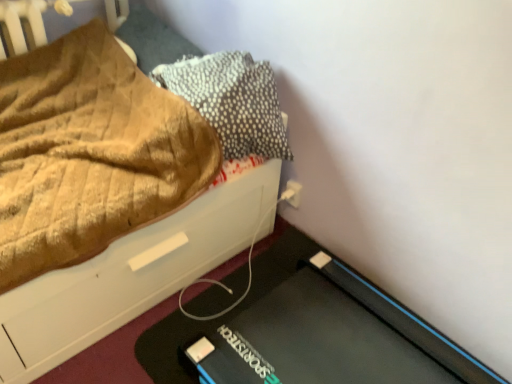
Question: Is brown textured pillow at upper left, placed as the 2th pillow when sorted from right to left, beside brown textured fabric at upper left?

Choices:
 (A) no
 (B) yes

Answer: (A)

Question: Is brown textured pillow at upper left, placed as the 2th pillow when sorted from right to left, shorter than brown textured fabric at upper left?

Choices:
 (A) yes
 (B) no

Answer: (A)

Question: Is brown textured pillow at upper left, positioned as the 1th pillow in left-to-right order, facing towards brown textured fabric at upper left?

Choices:
 (A) no
 (B) yes

Answer: (B)

Question: Is brown textured fabric at upper left located within brown textured pillow at upper left, placed as the 2th pillow when sorted from right to left?

Choices:
 (A) no
 (B) yes

Answer: (A)

Question: Is brown textured pillow at upper left, positioned as the 1th pillow in left-to-right order, not close to brown textured fabric at upper left?

Choices:
 (A) no
 (B) yes

Answer: (A)

Question: Does brown textured pillow at upper left, positioned as the 1th pillow in left-to-right order, lie behind brown textured fabric at upper left?

Choices:
 (A) yes
 (B) no

Answer: (A)

Question: Can you confirm if white plastic electric outlet at lower right is bigger than brown textured pillow at upper left, placed as the 2th pillow when sorted from right to left?

Choices:
 (A) no
 (B) yes

Answer: (A)

Question: Can we say white plastic electric outlet at lower right lies outside brown textured pillow at upper left, placed as the 2th pillow when sorted from right to left?

Choices:
 (A) no
 (B) yes

Answer: (B)

Question: Is white plastic electric outlet at lower right at the right side of brown textured pillow at upper left, positioned as the 1th pillow in left-to-right order?

Choices:
 (A) yes
 (B) no

Answer: (A)

Question: Is white plastic electric outlet at lower right taller than brown textured pillow at upper left, placed as the 2th pillow when sorted from right to left?

Choices:
 (A) no
 (B) yes

Answer: (A)

Question: Is white plastic electric outlet at lower right thinner than brown textured pillow at upper left, placed as the 2th pillow when sorted from right to left?

Choices:
 (A) yes
 (B) no

Answer: (A)

Question: Is white plastic electric outlet at lower right oriented away from brown textured pillow at upper left, placed as the 2th pillow when sorted from right to left?

Choices:
 (A) no
 (B) yes

Answer: (A)

Question: Is there a large distance between textured gray pillow at upper right, acting as the first pillow starting from the right, and brown textured pillow at upper left, placed as the 2th pillow when sorted from right to left?

Choices:
 (A) yes
 (B) no

Answer: (B)